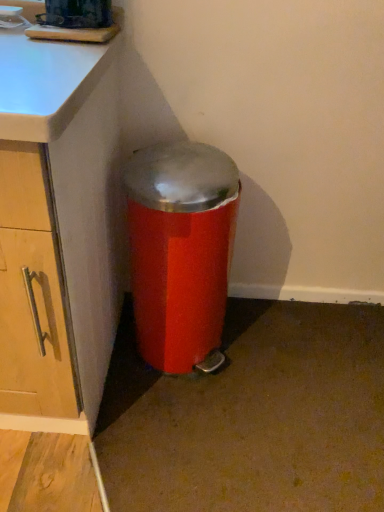
Question: Should I look upward or downward to see metallic red trash can at lower right?

Choices:
 (A) up
 (B) down

Answer: (B)